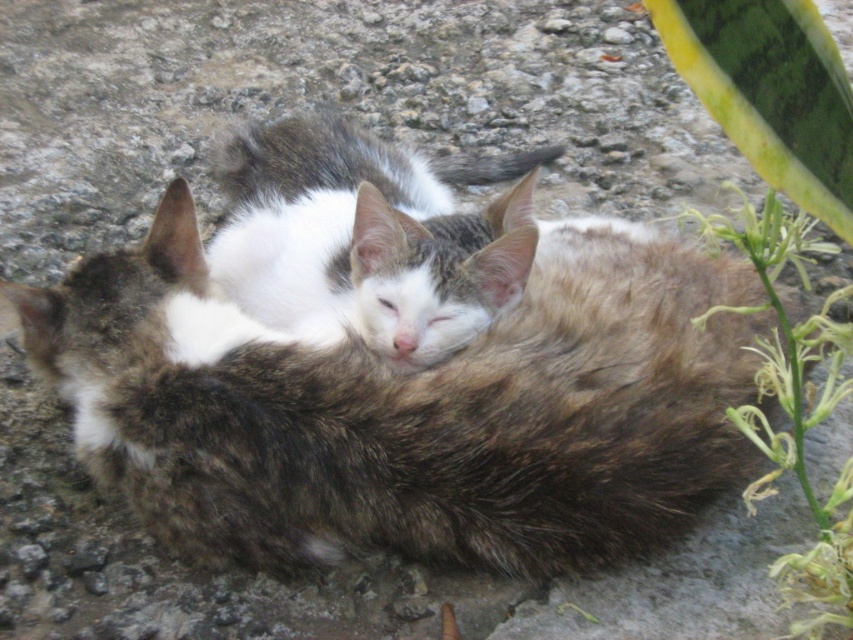
Question: Which object is closer to the camera taking this photo?

Choices:
 (A) fluffy brown cat at center
 (B) green leafy plant at right
 (C) white fur cat at center

Answer: (B)

Question: Can you confirm if white fur cat at center is positioned to the left of green leafy plant at right?

Choices:
 (A) yes
 (B) no

Answer: (A)

Question: Does fluffy brown cat at center have a larger size compared to green leafy plant at right?

Choices:
 (A) yes
 (B) no

Answer: (B)

Question: Considering the real-world distances, which object is farthest from the white fur cat at center?

Choices:
 (A) fluffy brown cat at center
 (B) green leafy plant at right

Answer: (B)

Question: Which is nearer to the green leafy plant at right?

Choices:
 (A) white fur cat at center
 (B) fluffy brown cat at center

Answer: (B)

Question: Does fluffy brown cat at center appear over green leafy plant at right?

Choices:
 (A) no
 (B) yes

Answer: (A)